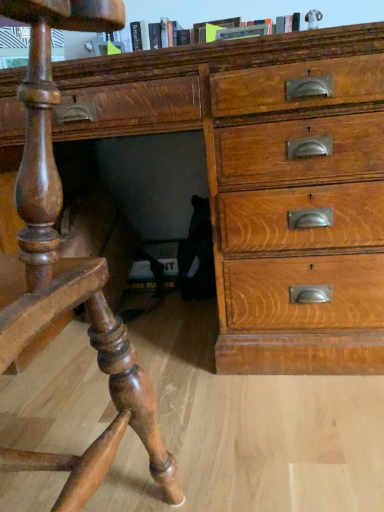
Question: From the image's perspective, would you say wooden chest of drawers at center is shown under shiny polished wood desk at lower left?

Choices:
 (A) yes
 (B) no

Answer: (B)

Question: Considering the relative positions of wooden chest of drawers at center and shiny polished wood desk at lower left in the image provided, is wooden chest of drawers at center behind shiny polished wood desk at lower left?

Choices:
 (A) no
 (B) yes

Answer: (B)

Question: Is wooden chest of drawers at center positioned in front of shiny polished wood desk at lower left?

Choices:
 (A) no
 (B) yes

Answer: (A)

Question: Does wooden chest of drawers at center have a smaller size compared to shiny polished wood desk at lower left?

Choices:
 (A) yes
 (B) no

Answer: (B)

Question: Is shiny polished wood desk at lower left completely or partially inside wooden chest of drawers at center?

Choices:
 (A) no
 (B) yes

Answer: (A)

Question: Does wooden chest of drawers at center turn towards shiny polished wood desk at lower left?

Choices:
 (A) yes
 (B) no

Answer: (A)

Question: Is hardcover book at upper center surrounded by shiny polished wood desk at lower left?

Choices:
 (A) no
 (B) yes

Answer: (A)

Question: Is shiny polished wood desk at lower left positioned before hardcover book at upper center?

Choices:
 (A) yes
 (B) no

Answer: (A)

Question: From a real-world perspective, does shiny polished wood desk at lower left stand above hardcover book at upper center?

Choices:
 (A) no
 (B) yes

Answer: (A)

Question: Is shiny polished wood desk at lower left with hardcover book at upper center?

Choices:
 (A) no
 (B) yes

Answer: (A)

Question: Is shiny polished wood desk at lower left positioned beyond the bounds of hardcover book at upper center?

Choices:
 (A) no
 (B) yes

Answer: (B)

Question: Considering the relative positions of shiny polished wood desk at lower left and hardcover book at upper center in the image provided, is shiny polished wood desk at lower left behind hardcover book at upper center?

Choices:
 (A) yes
 (B) no

Answer: (B)

Question: Can you confirm if shiny polished wood desk at lower left is taller than wooden chest of drawers at center?

Choices:
 (A) no
 (B) yes

Answer: (A)